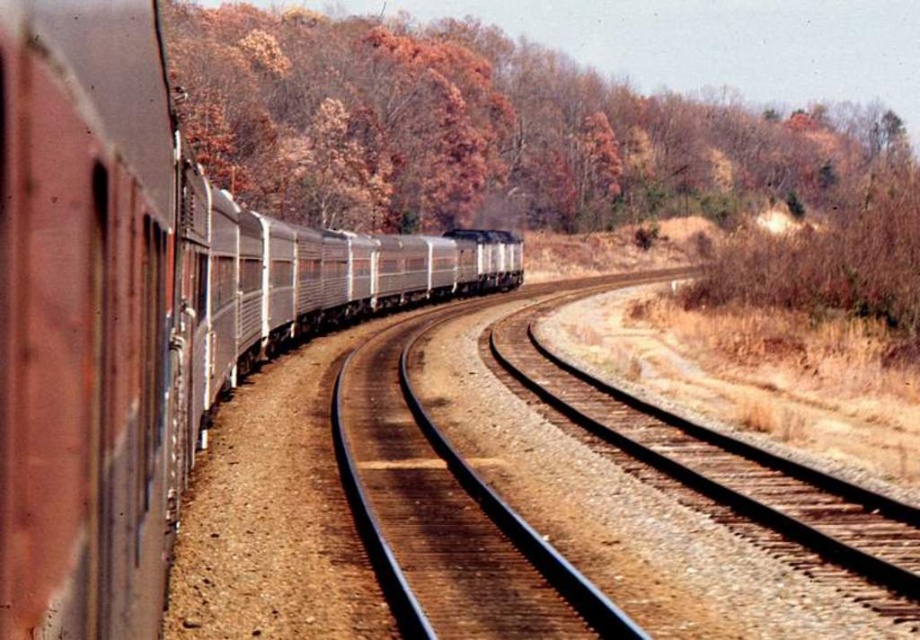
You are standing on the train tracks and see two points marked on the ground ahead of you. The first point is at coordinate point (12, 445) and the second point is at coordinate point (591, 620). Which point is closer to you?

Point (12, 445) is closer to the viewer than point (591, 620).